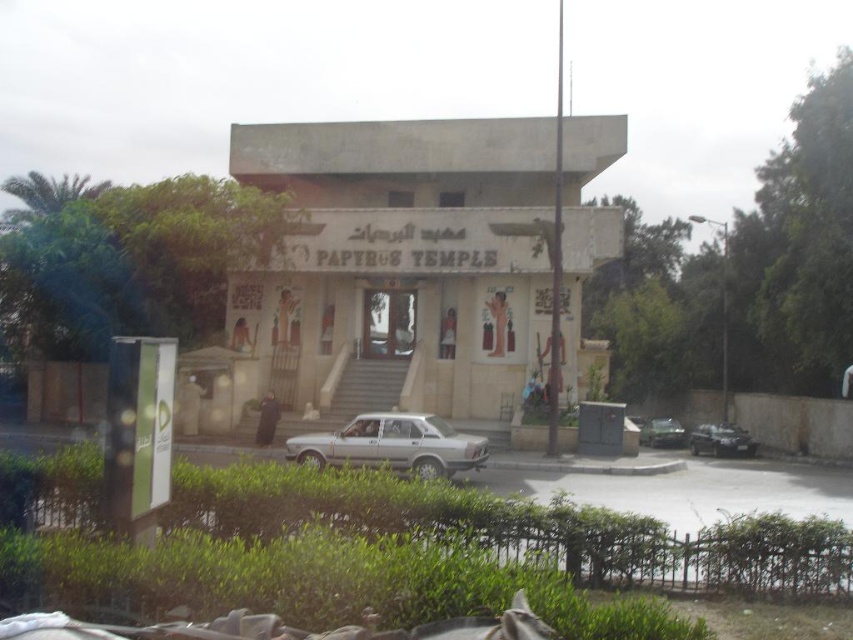
Question: Does green leafy shrubs at lower center have a larger size compared to silver metallic car at center?

Choices:
 (A) yes
 (B) no

Answer: (A)

Question: Considering the relative positions of silver metallic sedan at center and silver metallic car at center in the image provided, where is silver metallic sedan at center located with respect to silver metallic car at center?

Choices:
 (A) left
 (B) right

Answer: (A)

Question: Which object is positioned closest to the silver metallic car at center?

Choices:
 (A) satin silver sedan at center
 (B) green leafy shrubs at lower center
 (C) silver metallic sedan at center

Answer: (A)

Question: Which point is closer to the camera taking this photo?

Choices:
 (A) (741, 444)
 (B) (421, 529)

Answer: (B)

Question: Which of these objects is positioned farthest from the silver metallic sedan at center?

Choices:
 (A) silver metallic car at center
 (B) satin silver sedan at center
 (C) green leafy shrubs at lower center

Answer: (A)

Question: Does silver metallic sedan at center appear under satin silver sedan at center?

Choices:
 (A) no
 (B) yes

Answer: (A)